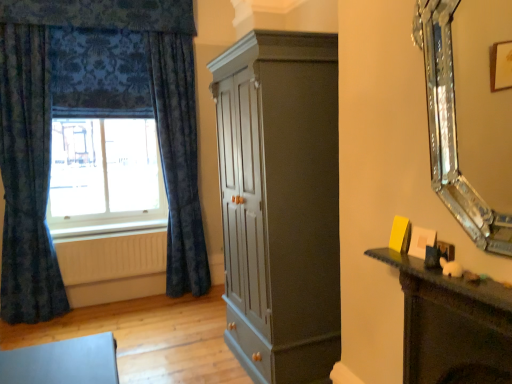
Question: From the image's perspective, is white wood at lower left below blue velvet curtains at left?

Choices:
 (A) no
 (B) yes

Answer: (B)

Question: Is white wood at lower left thinner than blue velvet curtains at left?

Choices:
 (A) no
 (B) yes

Answer: (A)

Question: From the image's perspective, is white wood at lower left on top of blue velvet curtains at left?

Choices:
 (A) yes
 (B) no

Answer: (B)

Question: Can you confirm if white wood at lower left is positioned to the left of blue velvet curtains at left?

Choices:
 (A) yes
 (B) no

Answer: (B)

Question: Is white wood at lower left located outside blue velvet curtains at left?

Choices:
 (A) no
 (B) yes

Answer: (B)

Question: From the image's perspective, is wooden radiator at lower left positioned above or below silver/glass mirror at right?

Choices:
 (A) above
 (B) below

Answer: (B)

Question: Is point (114, 276) positioned closer to the camera than point (440, 82)?

Choices:
 (A) farther
 (B) closer

Answer: (A)

Question: Is wooden radiator at lower left in front of or behind silver/glass mirror at right in the image?

Choices:
 (A) front
 (B) behind

Answer: (B)

Question: Is wooden radiator at lower left bigger or smaller than silver/glass mirror at right?

Choices:
 (A) small
 (B) big

Answer: (A)

Question: From a real-world perspective, relative to velvety blue curtain at left, which is the 2th curtain from left to right, is white wood at lower left vertically above or below?

Choices:
 (A) below
 (B) above

Answer: (A)

Question: Is point (58, 230) closer or farther from the camera than point (174, 96)?

Choices:
 (A) closer
 (B) farther

Answer: (A)

Question: Would you say white wood at lower left is to the left or to the right of velvety blue curtain at left, the first curtain viewed from the right, in the picture?

Choices:
 (A) right
 (B) left

Answer: (B)

Question: Considering the positions of white wood at lower left and velvety blue curtain at left, which is the 2th curtain from left to right, in the image, is white wood at lower left wider or thinner than velvety blue curtain at left, which is the 2th curtain from left to right,?

Choices:
 (A) thin
 (B) wide

Answer: (A)

Question: From the image's perspective, is velvety blue curtain at left, the first curtain viewed from the right, above or below dark blue textured curtain at left, the second curtain positioned from the right?

Choices:
 (A) above
 (B) below

Answer: (A)

Question: From a real-world perspective, relative to dark blue textured curtain at left, marked as the first curtain in a left-to-right arrangement, is velvety blue curtain at left, the first curtain viewed from the right, vertically above or below?

Choices:
 (A) above
 (B) below

Answer: (A)